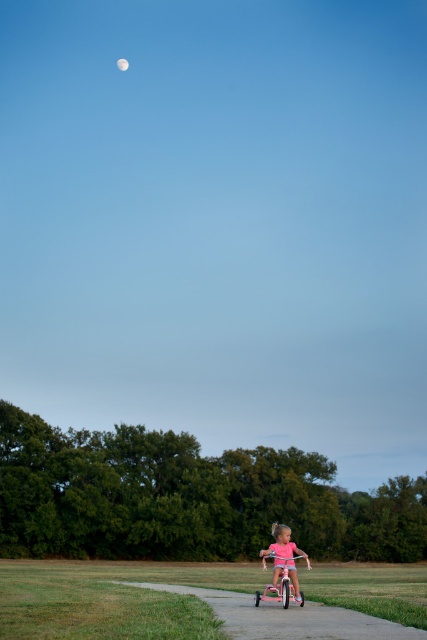
Between pink rubber pavement at lower center and pink matte tricycle at center, which one appears on the right side from the viewer's perspective?

pink matte tricycle at center is more to the right.

Which of these two, pink rubber pavement at lower center or pink matte tricycle at center, stands shorter?

Standing shorter between the two is pink rubber pavement at lower center.

Is point (307, 611) closer to viewer compared to point (290, 573)?

Yes, it is.

The height and width of the screenshot is (640, 427). What are the coordinates of `pink rubber pavement at lower center` in the screenshot? It's located at (287, 618).

Between pink rubber pavement at lower center and silvery reflective moon at upper center, which one is positioned lower?

pink rubber pavement at lower center is below.

Between pink rubber pavement at lower center and silvery reflective moon at upper center, which one has more height?

Standing taller between the two is pink rubber pavement at lower center.

In order to click on pink rubber pavement at lower center in this screenshot , I will do `click(287, 618)`.

Does pink matte tricycle at center have a lesser width compared to silvery reflective moon at upper center?

Correct, pink matte tricycle at center's width is less than silvery reflective moon at upper center's.

Consider the image. Is pink matte tricycle at center in front of silvery reflective moon at upper center?

Yes, pink matte tricycle at center is closer to the viewer.

Who is more forward, (266, 550) or (122, 61)?

Positioned in front is point (266, 550).

The height and width of the screenshot is (640, 427). Identify the location of pink matte tricycle at center. (283, 557).